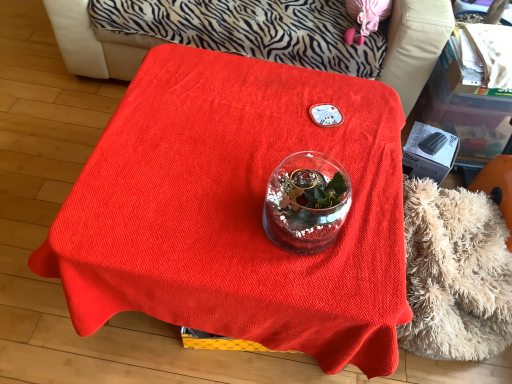
You are a GUI agent. You are given a task and a screenshot of the screen. Output one action in this format:
    pyautogui.click(x=<x>, y=<y>)
    Task: Click on the blank space to the left of transparent glass vase at center
    
    Given the screenshot: What is the action you would take?
    pyautogui.click(x=225, y=211)